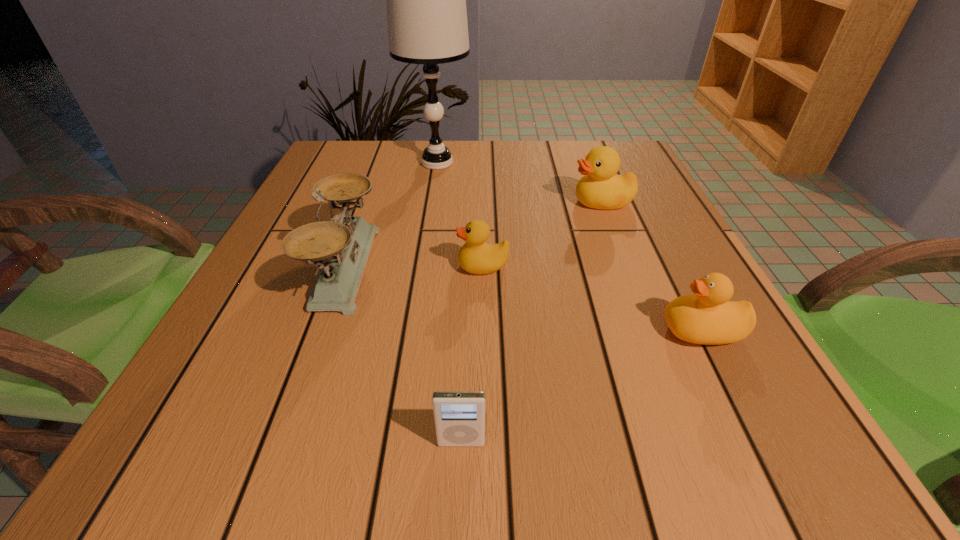
What are the coordinates of `object that is at the left edge` in the screenshot? It's located at tap(340, 247).

Image resolution: width=960 pixels, height=540 pixels. In the image, there is a desktop. In order to click on free space at the far edge in this screenshot , I will do `click(541, 149)`.

Find the location of a particular element. vacant area at the near edge is located at coordinates (507, 471).

Where is `vacant point at the right edge`? The height and width of the screenshot is (540, 960). vacant point at the right edge is located at coordinates (634, 226).

I want to click on vacant space at the far left corner of the desktop, so click(x=326, y=156).

At what (x,y) coordinates should I click in order to perform the action: click on vacant space at the near left corner of the desktop. Please return your answer as a coordinate pair (x, y). Looking at the image, I should click on (243, 468).

Identify the location of vacant region at the far right corner. (x=646, y=176).

At what (x,y) coordinates should I click in order to perform the action: click on vacant space at the near right corner. Please return your answer as a coordinate pair (x, y). Looking at the image, I should click on (753, 454).

You are a GUI agent. You are given a task and a screenshot of the screen. Output one action in this format:
    pyautogui.click(x=<x>, y=<y>)
    Task: Click on the free spot between the nearest object and the nearest duck
    
    Given the screenshot: What is the action you would take?
    pyautogui.click(x=582, y=387)

In order to click on free space that is in between the nearest object and the fifth shortest object in this screenshot , I will do [x=403, y=355].